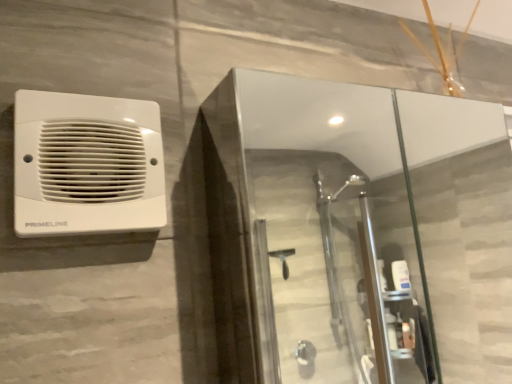
Based on the photo, measure the distance between transparent glass shower door at upper center and camera.

transparent glass shower door at upper center is 4.59 feet from camera.

What do you see at coordinates (332, 231) in the screenshot?
I see `transparent glass shower door at upper center` at bounding box center [332, 231].

This screenshot has height=384, width=512. In order to click on transparent glass shower door at upper center in this screenshot , I will do `click(332, 231)`.

Describe the element at coordinates (87, 164) in the screenshot. This screenshot has height=384, width=512. I see `white plastic speaker at upper left` at that location.

Locate an element on the screen. The height and width of the screenshot is (384, 512). white plastic speaker at upper left is located at coordinates (87, 164).

Find the location of a particular element. This screenshot has height=384, width=512. transparent glass shower door at upper center is located at coordinates [x=332, y=231].

Is white plastic speaker at upper left at the right side of transparent glass shower door at upper center?

Incorrect, white plastic speaker at upper left is not on the right side of transparent glass shower door at upper center.

Which is behind, white plastic speaker at upper left or transparent glass shower door at upper center?

white plastic speaker at upper left is further away from the camera.

Between point (105, 185) and point (395, 328), which one is positioned in front?

Positioned in front is point (105, 185).

From the image's perspective, is white plastic speaker at upper left positioned above or below transparent glass shower door at upper center?

white plastic speaker at upper left is above transparent glass shower door at upper center.

From a real-world perspective, which object rests below the other?

In real-world perspective, transparent glass shower door at upper center is lower.

Based on the photo, between white plastic speaker at upper left and transparent glass shower door at upper center, which one has smaller width?

white plastic speaker at upper left is thinner.

Is white plastic speaker at upper left taller than transparent glass shower door at upper center?

Incorrect, the height of white plastic speaker at upper left is not larger of that of transparent glass shower door at upper center.

In terms of size, does white plastic speaker at upper left appear bigger or smaller than transparent glass shower door at upper center?

Clearly, white plastic speaker at upper left is smaller in size than transparent glass shower door at upper center.

Is transparent glass shower door at upper center located within white plastic speaker at upper left?

That's incorrect, transparent glass shower door at upper center is not inside white plastic speaker at upper left.

Does white plastic speaker at upper left touch transparent glass shower door at upper center?

They are not placed beside each other.

Is transparent glass shower door at upper center at the back of white plastic speaker at upper left?

No, white plastic speaker at upper left is not facing away from transparent glass shower door at upper center.

How many degrees apart are the facing directions of white plastic speaker at upper left and transparent glass shower door at upper center?

white plastic speaker at upper left and transparent glass shower door at upper center are facing 0.00497 degrees away from each other.

Measure the distance between white plastic speaker at upper left and transparent glass shower door at upper center.

white plastic speaker at upper left and transparent glass shower door at upper center are 1.71 meters apart from each other.

There is a transparent glass shower door at upper center. At what (x,y) coordinates should I click in order to perform the action: click on home appliance above it (from a real-world perspective). Please return your answer as a coordinate pair (x, y). This screenshot has width=512, height=384. Looking at the image, I should click on (87, 164).

Between transparent glass shower door at upper center and white plastic speaker at upper left, which one appears on the left side from the viewer's perspective?

Positioned to the left is white plastic speaker at upper left.

Which object is closer to the camera taking this photo, transparent glass shower door at upper center or white plastic speaker at upper left?

transparent glass shower door at upper center is in front.

Which is closer, [278,307] or [65,168]?

Positioned in front is point [65,168].

From the image's perspective, which one is positioned higher, transparent glass shower door at upper center or white plastic speaker at upper left?

white plastic speaker at upper left is shown above in the image.

From a real-world perspective, relative to white plastic speaker at upper left, is transparent glass shower door at upper center vertically above or below?

In terms of real-world spatial position, transparent glass shower door at upper center is below white plastic speaker at upper left.

Considering the sizes of objects transparent glass shower door at upper center and white plastic speaker at upper left in the image provided, who is wider, transparent glass shower door at upper center or white plastic speaker at upper left?

transparent glass shower door at upper center.

Which of these two, transparent glass shower door at upper center or white plastic speaker at upper left, stands shorter?

white plastic speaker at upper left.

Looking at this image, does transparent glass shower door at upper center have a larger size compared to white plastic speaker at upper left?

Yes, transparent glass shower door at upper center is bigger than white plastic speaker at upper left.

Is transparent glass shower door at upper center positioned beyond the bounds of white plastic speaker at upper left?

Yes, transparent glass shower door at upper center is located beyond the bounds of white plastic speaker at upper left.

Would you say transparent glass shower door at upper center is a long distance from white plastic speaker at upper left?

Yes, transparent glass shower door at upper center and white plastic speaker at upper left are quite far apart.

Is white plastic speaker at upper left at the back of transparent glass shower door at upper center?

No, transparent glass shower door at upper center is not facing away from white plastic speaker at upper left.

What's the angular difference between transparent glass shower door at upper center and white plastic speaker at upper left's facing directions?

transparent glass shower door at upper center and white plastic speaker at upper left are facing 0.00497 degrees away from each other.

How much distance is there between transparent glass shower door at upper center and white plastic speaker at upper left?

transparent glass shower door at upper center and white plastic speaker at upper left are 5.61 feet apart from each other.

This screenshot has height=384, width=512. I want to click on home appliance above the transparent glass shower door at upper center (from the image's perspective), so click(x=87, y=164).

You are a GUI agent. You are given a task and a screenshot of the screen. Output one action in this format:
    pyautogui.click(x=<x>, y=<y>)
    Task: Click on the home appliance located on the left of transparent glass shower door at upper center
    
    Given the screenshot: What is the action you would take?
    pyautogui.click(x=87, y=164)

Image resolution: width=512 pixels, height=384 pixels. What are the coordinates of `home appliance lying behind the transparent glass shower door at upper center` in the screenshot? It's located at (87, 164).